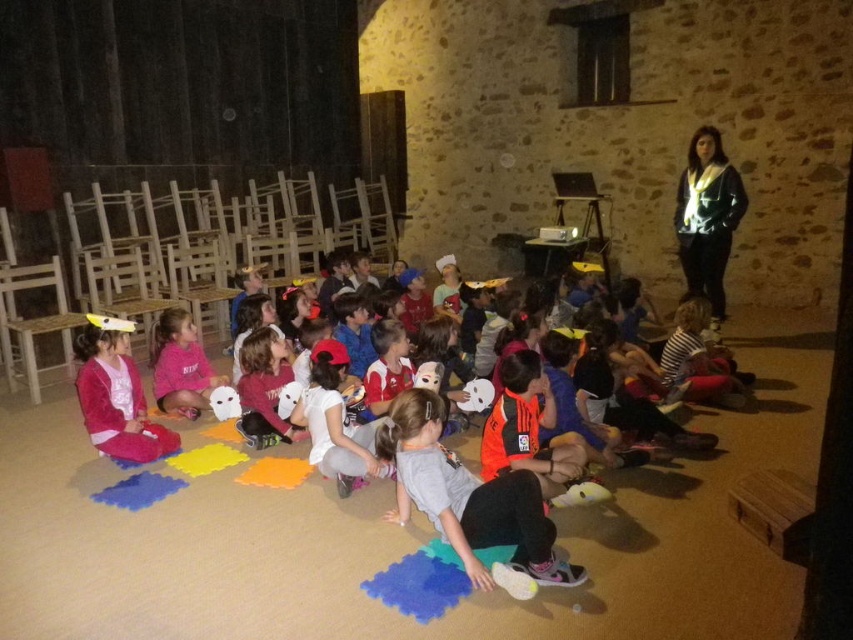
Question: Is orange jersey at center positioned before pink fleece sweatshirt at center?

Choices:
 (A) yes
 (B) no

Answer: (A)

Question: Which is farther from the pink fleece sweatshirt at center?

Choices:
 (A) pink fabric mask at lower left
 (B) orange jersey at center

Answer: (B)

Question: Which of the following is the farthest from the observer?

Choices:
 (A) (122, 448)
 (B) (194, 404)

Answer: (B)

Question: Which of the following is the closest to the observer?

Choices:
 (A) orange jersey at center
 (B) pink fabric mask at lower left

Answer: (A)

Question: Can you confirm if orange jersey at center is wider than pink fabric mask at lower left?

Choices:
 (A) no
 (B) yes

Answer: (B)

Question: Is pink fabric mask at lower left below pink fleece sweatshirt at center?

Choices:
 (A) no
 (B) yes

Answer: (B)